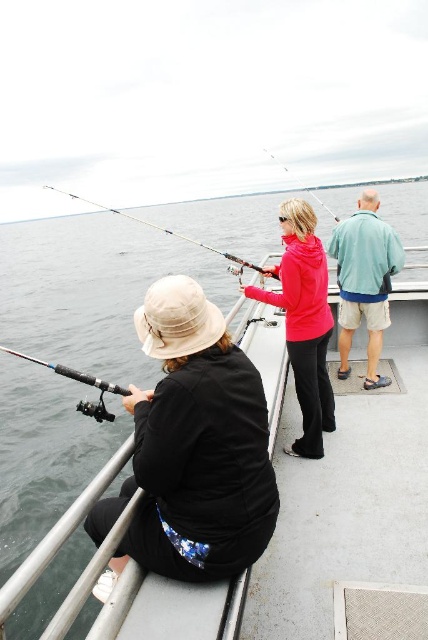
You are on a fishing boat and need to choose between the metallic fishing rod at center and the black matte fishing pole at left. Which one is thinner?

The metallic fishing rod at center has a lesser width compared to the black matte fishing pole at left, so the metallic fishing rod at center is thinner.

You are planning to place a rectangular box that is 1.2 meters wide on the deck of the boat. The box must fit entirely within the space between the matte pink hoodie at center and the black matte fishing pole at left. Can the box fit in that space?

The matte pink hoodie at center is wider than the black matte fishing pole at left. However, the description only provides information about their widths, not the distance between them. Without knowing the actual space between the two objects, it is impossible to determine if the box will fit.

You are on a boat and need to retrieve the metallic fishing rod at center and the black matte fishing pole at left. Which one is easier to reach without moving your position?

The black matte fishing pole at left is easier to reach because it is located below the metallic fishing rod at center, making it closer to your current position.